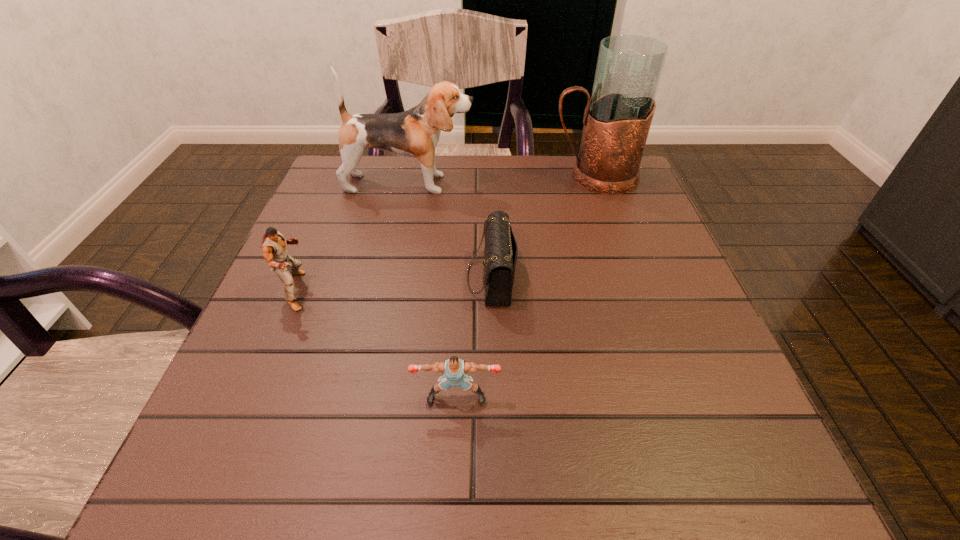
The image size is (960, 540). Identify the location of free space located at the face of the puppy. (553, 184).

Identify the location of vacant area situated on the front-facing side of the farther puncher. point(453,291).

Find the location of `vacant space located on the front flap of the clutch bag`. vacant space located on the front flap of the clutch bag is located at coordinates (315, 277).

You are a GUI agent. You are given a task and a screenshot of the screen. Output one action in this format:
    pyautogui.click(x=<x>, y=<y>)
    Task: Click on the blank space located 0.310m on the front flap of the clutch bag
    The image size is (960, 540).
    Given the screenshot: What is the action you would take?
    pyautogui.click(x=310, y=277)

I want to click on vacant space located on the front flap of the clutch bag, so click(330, 277).

The image size is (960, 540). Find the location of `vacant region located on the front-facing side of the nearest object`. vacant region located on the front-facing side of the nearest object is located at coordinates (452, 489).

This screenshot has width=960, height=540. Find the location of `pitcher at the far edge`. pitcher at the far edge is located at coordinates (617, 119).

You are a GUI agent. You are given a task and a screenshot of the screen. Output one action in this format:
    pyautogui.click(x=<x>, y=<y>)
    Task: Click on the puppy located at the far edge
    
    Given the screenshot: What is the action you would take?
    pyautogui.click(x=415, y=133)

Where is `puppy present at the left edge`? The width and height of the screenshot is (960, 540). puppy present at the left edge is located at coordinates (415, 133).

Where is `puncher that is positioned at the left edge`? The image size is (960, 540). puncher that is positioned at the left edge is located at coordinates (274, 245).